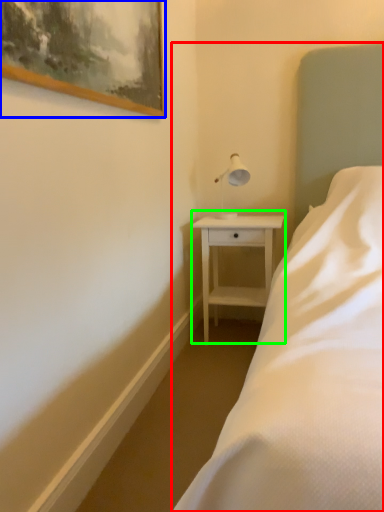
Question: Which is nearer to the bed (highlighted by a red box)? picture frame (highlighted by a blue box) or nightstand (highlighted by a green box).

Choices:
 (A) picture frame
 (B) nightstand

Answer: (B)